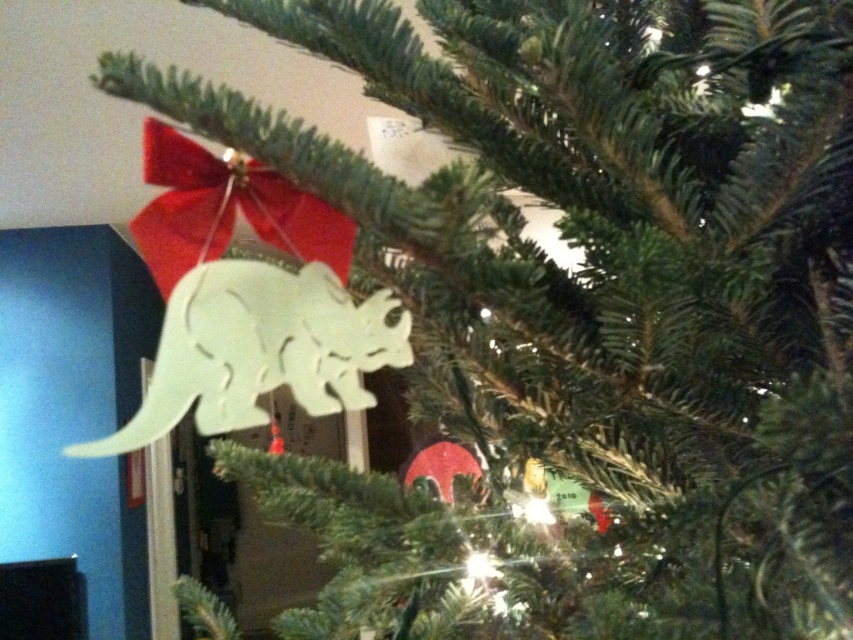
Question: Can you confirm if white matte wood dinosaur at center is bigger than matte white dinosaur at upper center?

Choices:
 (A) yes
 (B) no

Answer: (A)

Question: Considering the relative positions of white matte wood dinosaur at center and matte white dinosaur at upper center in the image provided, where is white matte wood dinosaur at center located with respect to matte white dinosaur at upper center?

Choices:
 (A) below
 (B) above

Answer: (A)

Question: From the image, what is the correct spatial relationship of white matte wood dinosaur at center in relation to matte white dinosaur at upper center?

Choices:
 (A) above
 (B) below

Answer: (B)

Question: Among these objects, which one is nearest to the camera?

Choices:
 (A) white matte wood dinosaur at center
 (B) matte white dinosaur at upper center

Answer: (B)

Question: Which object is closer to the camera taking this photo?

Choices:
 (A) matte white dinosaur at upper center
 (B) white matte wood dinosaur at center

Answer: (A)

Question: Which of the following is the closest to the observer?

Choices:
 (A) white matte wood dinosaur at center
 (B) matte white dinosaur at upper center

Answer: (B)